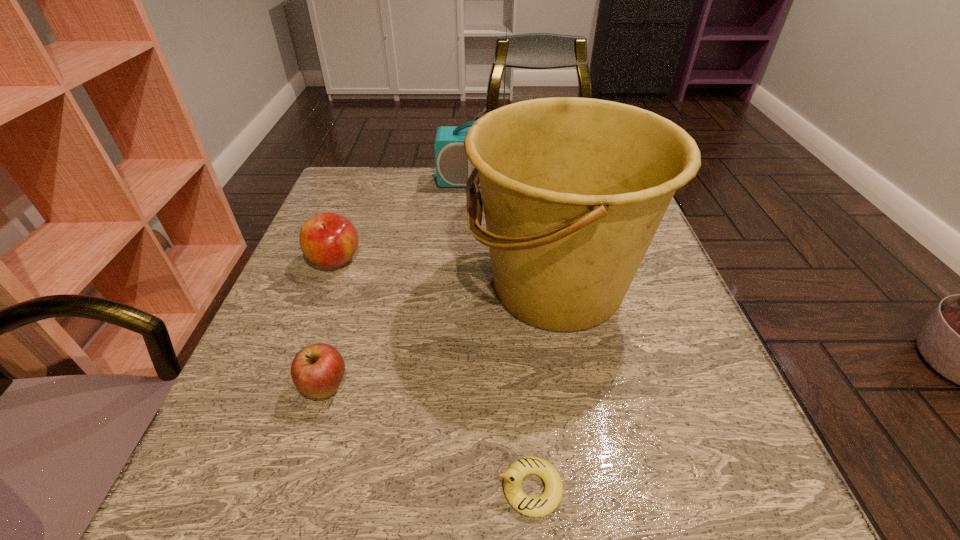
Locate an element on the screen. Image resolution: width=960 pixels, height=540 pixels. vacant space situated on the front of the farther apple is located at coordinates (322, 295).

At what (x,y) coordinates should I click in order to perform the action: click on free region located 0.080m on the back of the second nearest object. Please return your answer as a coordinate pair (x, y). Looking at the image, I should click on (343, 332).

Identify the location of free space located on the face of the duckling. The image size is (960, 540). (409, 488).

Where is `vacant space positioned 0.190m on the face of the duckling`? This screenshot has height=540, width=960. vacant space positioned 0.190m on the face of the duckling is located at coordinates (357, 488).

Locate an element on the screen. vacant space located 0.350m on the face of the duckling is located at coordinates (237, 488).

At what (x,y) coordinates should I click in order to perform the action: click on object that is positioned at the far edge. Please return your answer as a coordinate pair (x, y). The image size is (960, 540). Looking at the image, I should click on (453, 168).

The width and height of the screenshot is (960, 540). Find the location of `object that is at the near edge`. object that is at the near edge is located at coordinates (540, 506).

What are the coordinates of `object that is at the right edge` in the screenshot? It's located at (574, 189).

Locate an element on the screen. This screenshot has height=540, width=960. free space at the far edge is located at coordinates (454, 190).

In the image, there is a desktop. In order to click on free region at the left edge in this screenshot , I will do `click(296, 291)`.